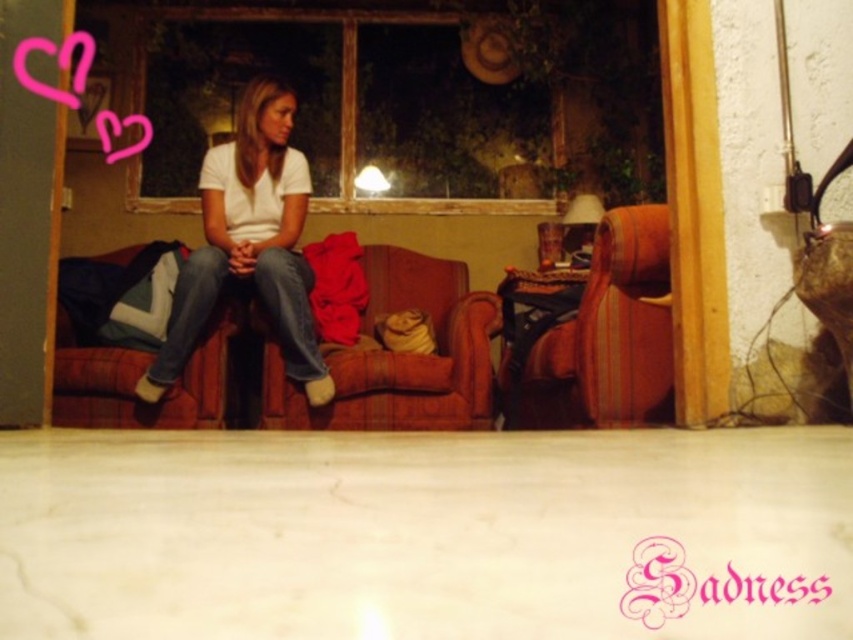
You are a delivery robot that needs to place a package between the white matte shirt at center and the brown leather armchair at right. Can you fit the package there if it requires 1 meter of space?

The distance between the white matte shirt at center and the brown leather armchair at right is 1.09 meters, so yes, the package requiring 1 meter of space can fit between them.